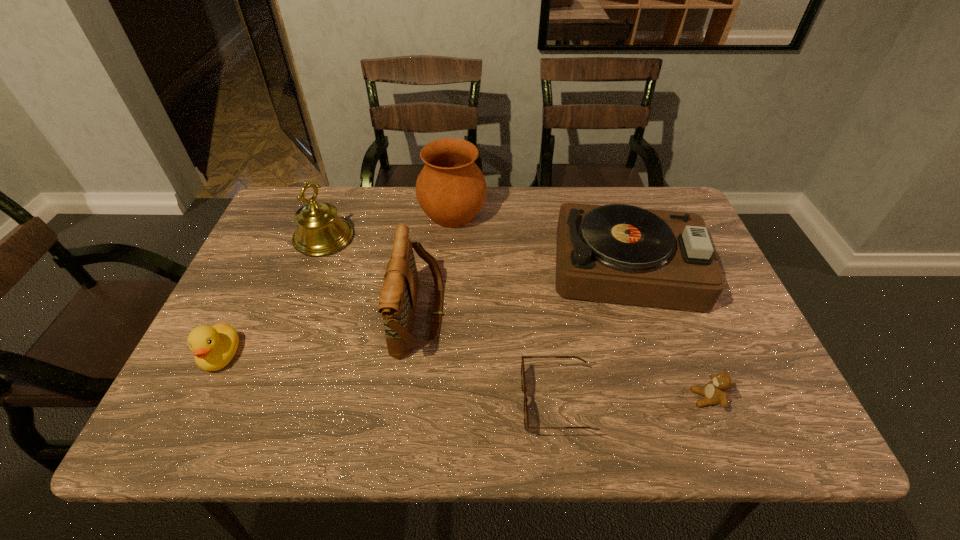
Where is `unoccupied area between the record player and the pottery`? Image resolution: width=960 pixels, height=540 pixels. unoccupied area between the record player and the pottery is located at coordinates (542, 240).

Locate an element on the screen. The image size is (960, 540). free space between the pottery and the shortest object is located at coordinates (504, 308).

Where is `free spot between the pottery and the shortest object`? The image size is (960, 540). free spot between the pottery and the shortest object is located at coordinates (504, 308).

The width and height of the screenshot is (960, 540). In order to click on vacant area that lies between the second shortest object and the fifth tallest object in this screenshot , I will do `click(464, 377)`.

The image size is (960, 540). I want to click on free space between the spectacles and the record player, so click(594, 335).

Where is `free space that is in between the teddy bear and the shortest object`? The image size is (960, 540). free space that is in between the teddy bear and the shortest object is located at coordinates (631, 400).

Identify the location of the fifth closest object to the spectacles. The height and width of the screenshot is (540, 960). (320, 231).

Where is `the fifth closest object to the shortest object`? the fifth closest object to the shortest object is located at coordinates (320, 231).

You are a GUI agent. You are given a task and a screenshot of the screen. Output one action in this format:
    pyautogui.click(x=<x>, y=<y>)
    Task: Click on the free space that satisfies the following two spatial constraints: 1. on the front-facing side of the shoulder bag; 2. on the face of the third shortest object
    This screenshot has height=540, width=960.
    Given the screenshot: What is the action you would take?
    pyautogui.click(x=414, y=356)

Where is `free location that satisfies the following two spatial constraints: 1. on the front-facing side of the shoulder bag; 2. on the face of the third shortest object`? The image size is (960, 540). free location that satisfies the following two spatial constraints: 1. on the front-facing side of the shoulder bag; 2. on the face of the third shortest object is located at coordinates (414, 356).